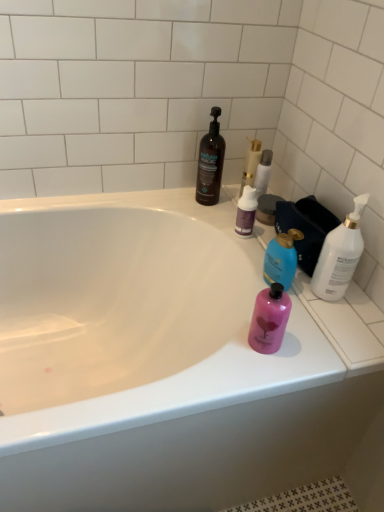
Locate an element on the screen. free area in between purple matte bottle at upper center, the fourth bottle in the right-to-left sequence, and dark brown plastic bottle at upper center, arranged as the 5th bottle when viewed from the right is located at coordinates (216, 218).